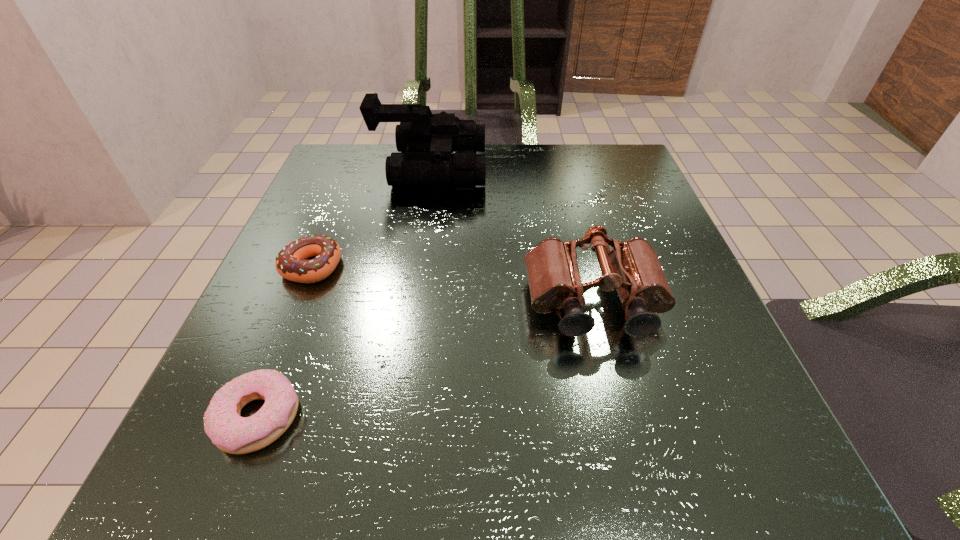
Locate an element on the screen. the farthest object is located at coordinates (425, 142).

The width and height of the screenshot is (960, 540). What are the coordinates of `the taller binoculars` in the screenshot? It's located at (425, 142).

This screenshot has height=540, width=960. In order to click on the shorter binoculars in this screenshot , I will do `click(632, 268)`.

Find the location of a particular element. the third shortest object is located at coordinates (632, 268).

Locate an element on the screen. The height and width of the screenshot is (540, 960). the farther doughnut is located at coordinates (290, 263).

This screenshot has width=960, height=540. Identify the location of the shortest object. (231, 433).

Locate an element on the screen. the nearer doughnut is located at coordinates (231, 433).

Where is `free space located 0.340m on the front lenses of the taller binoculars`? This screenshot has width=960, height=540. free space located 0.340m on the front lenses of the taller binoculars is located at coordinates (634, 169).

This screenshot has height=540, width=960. Find the location of `free space located through the eyepieces of the nearer binoculars`. free space located through the eyepieces of the nearer binoculars is located at coordinates (641, 493).

Locate an element on the screen. The image size is (960, 540). blank space located 0.310m on the back of the farther doughnut is located at coordinates (354, 161).